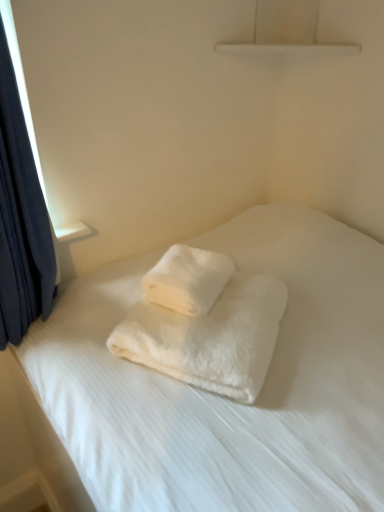
Question: From a real-world perspective, is white fluffy towel at center, which is the 1th towel from top to bottom, above or below white fluffy towels at center?

Choices:
 (A) below
 (B) above

Answer: (B)

Question: Looking at the image, does white fluffy towel at center, which is the 1th towel from top to bottom, seem bigger or smaller compared to white fluffy towels at center?

Choices:
 (A) big
 (B) small

Answer: (B)

Question: Which of these objects is positioned closest to the white fluffy towel at center, which is the first towel from bottom to top?

Choices:
 (A) white fluffy towel at center, which ranks as the 2th towel in bottom-to-top order
 (B) white fluffy towels at center

Answer: (A)

Question: Considering the real-world distances, which object is closest to the white fluffy towel at center, which ranks as the 2th towel in bottom-to-top order?

Choices:
 (A) white fluffy towel at center, the second towel when ordered from top to bottom
 (B) white fluffy towels at center

Answer: (A)